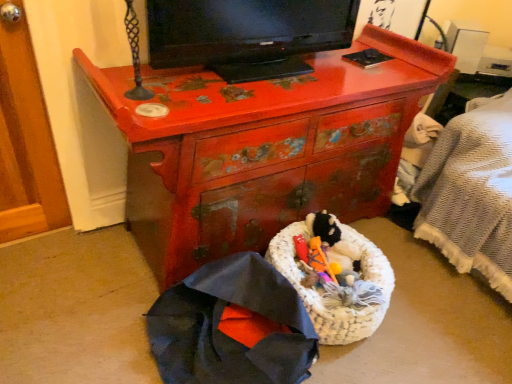
Where is `vacant area that lies between dark blue fabric umbrella at lower left and white woven laundry basket at center`? vacant area that lies between dark blue fabric umbrella at lower left and white woven laundry basket at center is located at coordinates (362, 350).